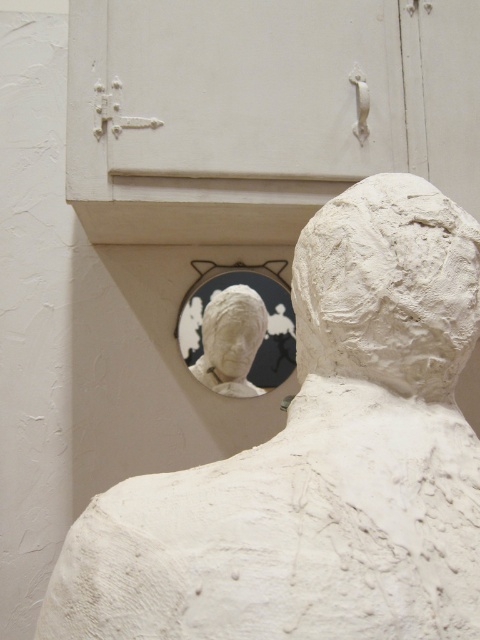
Question: Which point is farther to the camera?

Choices:
 (A) white glossy mirror at center
 (B) white plaster bust at center

Answer: (B)

Question: Does white clay bust at upper center lie in front of white clay head at center?

Choices:
 (A) yes
 (B) no

Answer: (A)

Question: Can you confirm if white clay bust at upper center is positioned to the left of white clay head at center?

Choices:
 (A) yes
 (B) no

Answer: (A)

Question: From the image, what is the correct spatial relationship of white clay head at center in relation to white plaster bust at center?

Choices:
 (A) above
 (B) below

Answer: (A)

Question: Which of the following is the farthest from the observer?

Choices:
 (A) white clay bust at upper center
 (B) white clay head at center

Answer: (B)

Question: Which point is closer to the camera?

Choices:
 (A) white clay head at center
 (B) white glossy mirror at center
 (C) white plaster bust at center
 (D) white clay bust at upper center

Answer: (D)